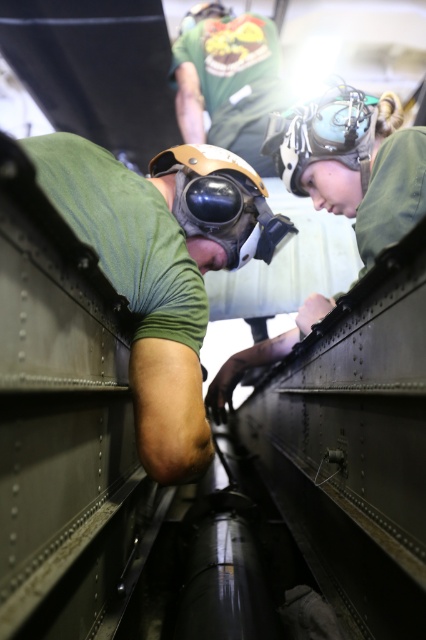
You are a safety inspector in this confined space. You need to ensure that the green matte helmet at center and the matte black helmet at center meet safety standards. Which helmet has a greater height requirement?

The green matte helmet at center is much taller than the matte black helmet at center, so it meets the greater height requirement.

In the scene shown: You are a safety inspector in this confined space. You need to ensure that the green matte helmet at center and the matte black helmet at center meet the size requirements for proper fit. Which helmet has a larger size?

The green matte helmet at center has a larger size compared to the matte black helmet at center.

You are a safety inspector in this confined space. You notice two helmets at the center of your view. Which helmet is positioned lower between the green matte helmet at center and the matte black helmet at center?

The green matte helmet at center is located below the matte black helmet at center, so the green matte helmet at center is positioned lower.